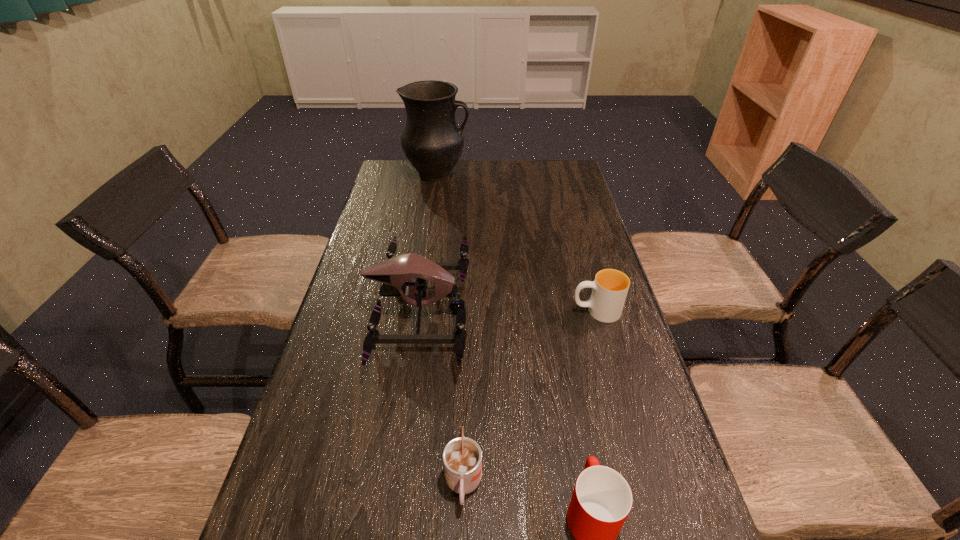
This screenshot has width=960, height=540. Find the location of `vacant area that satisfies the following two spatial constraints: 1. on the handle side of the tallest object; 2. with the handle on the side of the farthest cup`. vacant area that satisfies the following two spatial constraints: 1. on the handle side of the tallest object; 2. with the handle on the side of the farthest cup is located at coordinates (417, 311).